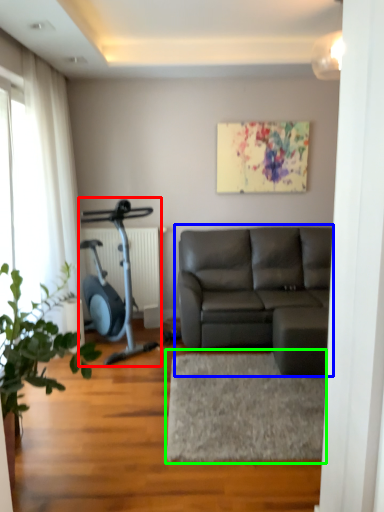
Question: Estimate the real-world distances between objects in this image. Which object is closer to stationary bicycle (highlighted by a red box), studio couch (highlighted by a blue box) or flat (highlighted by a green box)?

Choices:
 (A) studio couch
 (B) flat

Answer: (A)